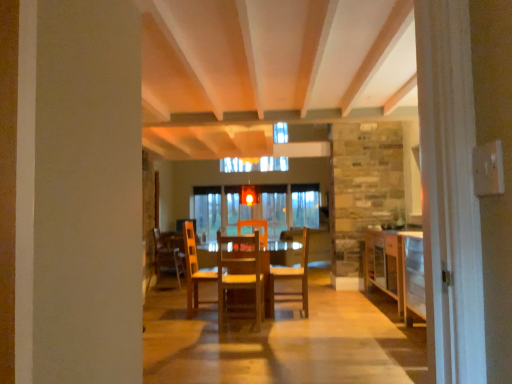
Question: In which direction should I rotate to look at wooden chair at center, which is the 3th chair from right to left?

Choices:
 (A) left
 (B) right

Answer: (A)

Question: Can you confirm if wooden cabinet at right is wider than wooden table at center?

Choices:
 (A) no
 (B) yes

Answer: (A)

Question: From the image's perspective, is wooden cabinet at right above wooden table at center?

Choices:
 (A) yes
 (B) no

Answer: (A)

Question: From the image's perspective, is wooden cabinet at right under wooden table at center?

Choices:
 (A) yes
 (B) no

Answer: (B)

Question: Is wooden cabinet at right positioned before wooden table at center?

Choices:
 (A) no
 (B) yes

Answer: (A)

Question: Does wooden cabinet at right come behind wooden table at center?

Choices:
 (A) no
 (B) yes

Answer: (B)

Question: Can you confirm if wooden cabinet at right is positioned to the left of wooden table at center?

Choices:
 (A) yes
 (B) no

Answer: (B)

Question: From the image's perspective, is wooden cabinet at right above wooden chair at center, which is the 1th chair in back-to-front order?

Choices:
 (A) no
 (B) yes

Answer: (B)

Question: Can you confirm if wooden cabinet at right is wider than wooden chair at center, which is the 3th chair from right to left?

Choices:
 (A) no
 (B) yes

Answer: (B)

Question: Considering the relative sizes of wooden cabinet at right and wooden chair at center, which is the 3th chair from right to left, in the image provided, is wooden cabinet at right shorter than wooden chair at center, which is the 3th chair from right to left,?

Choices:
 (A) yes
 (B) no

Answer: (B)

Question: Is wooden cabinet at right far away from wooden chair at center, the third chair viewed from the front?

Choices:
 (A) no
 (B) yes

Answer: (B)

Question: Is wooden cabinet at right taller than wooden chair at center, the third chair viewed from the front?

Choices:
 (A) no
 (B) yes

Answer: (B)

Question: Considering the relative positions of wooden cabinet at right and wooden chair at center, which is the 3th chair from right to left, in the image provided, is wooden cabinet at right to the left of wooden chair at center, which is the 3th chair from right to left, from the viewer's perspective?

Choices:
 (A) no
 (B) yes

Answer: (A)

Question: Is wooden table at center closer to the viewer compared to wooden chair at center, which ranks as the second chair in left-to-right order?

Choices:
 (A) yes
 (B) no

Answer: (B)